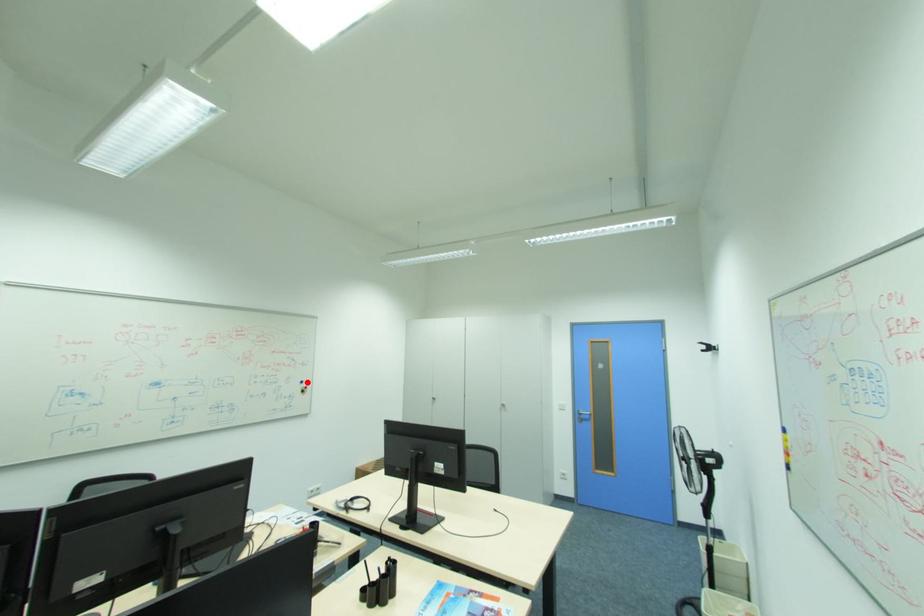
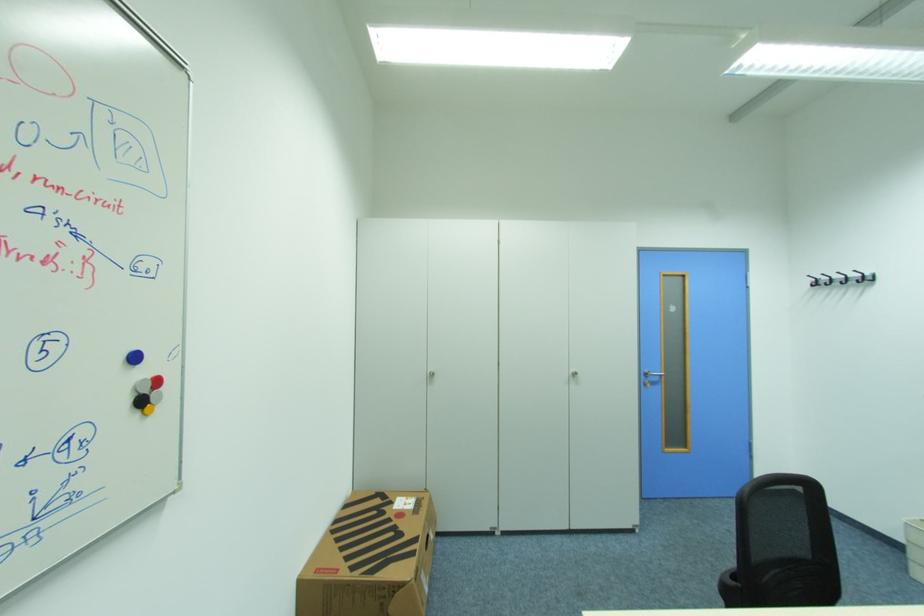
Locate, in the second image, the point that corresponds to the highlighted location in the first image.

(140, 359)